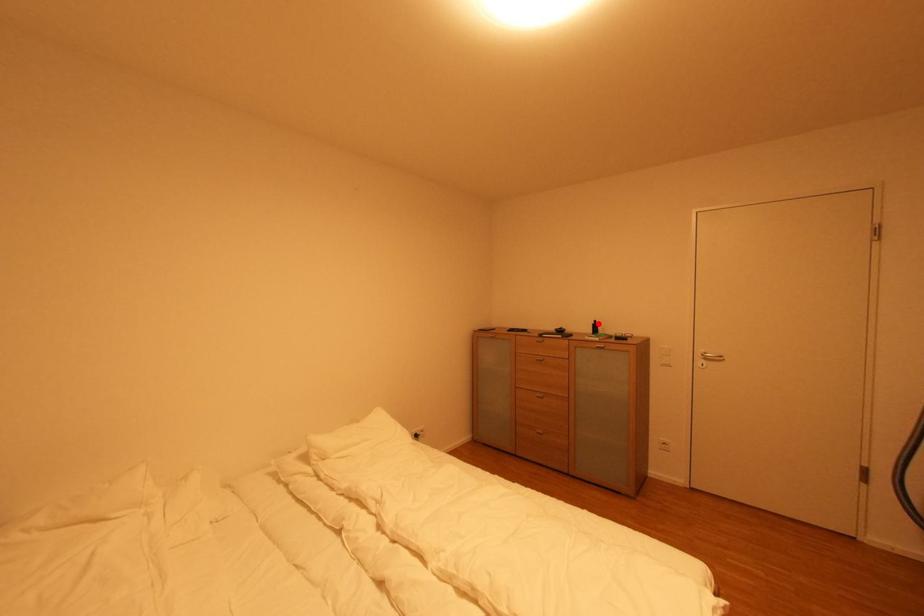
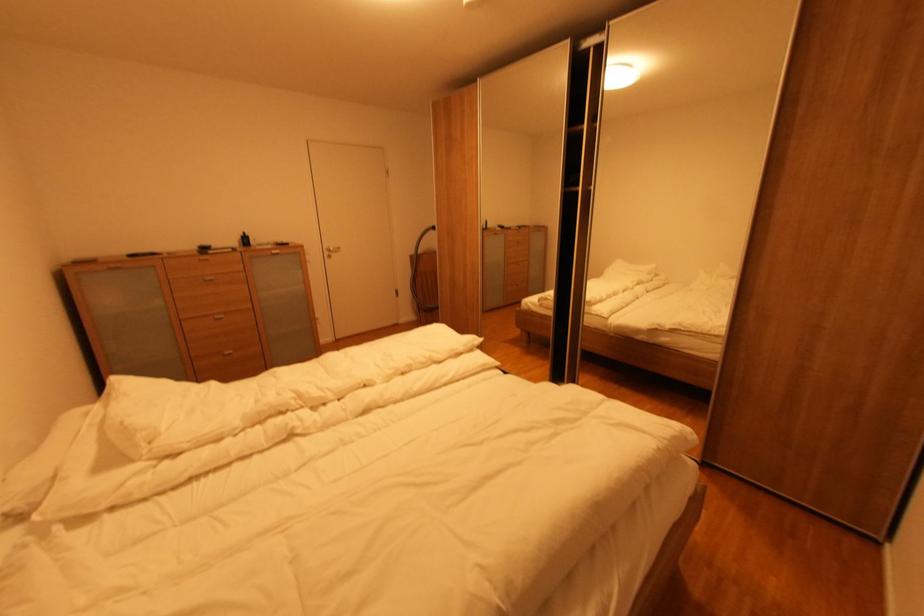
Where in the second image is the point corresponding to the highlighted location from the first image?

(248, 237)